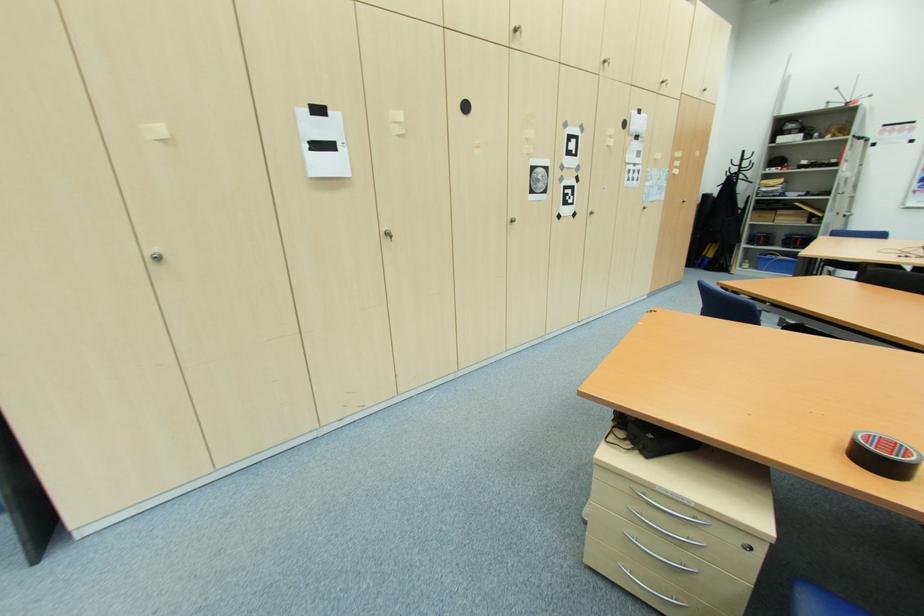
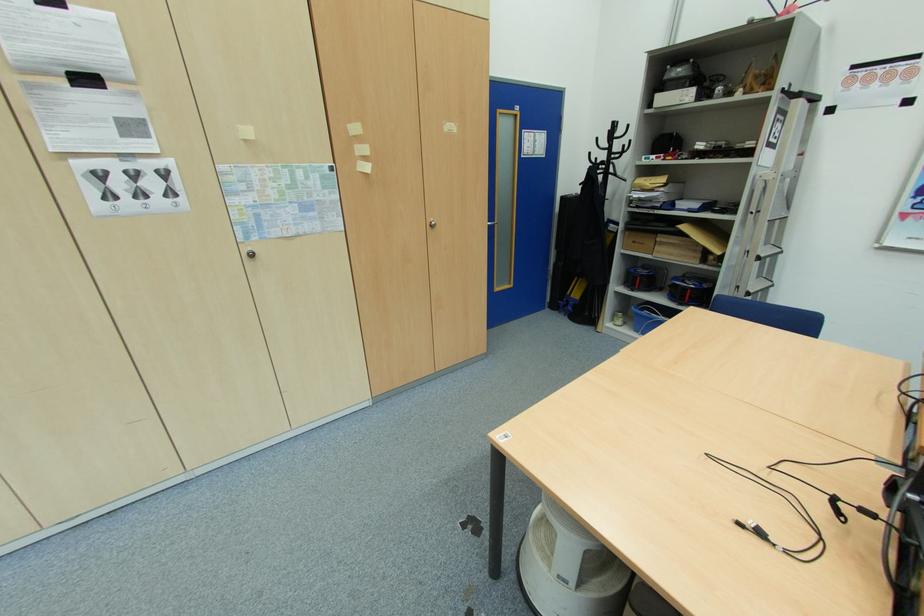
Where in the second image is the point corresponding to point 770,257 from the first image?

(646, 310)